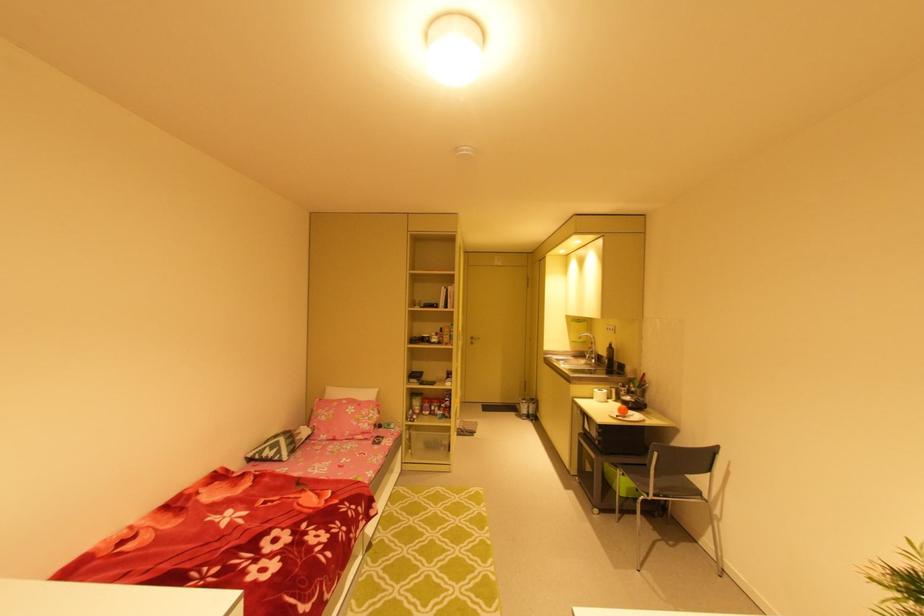
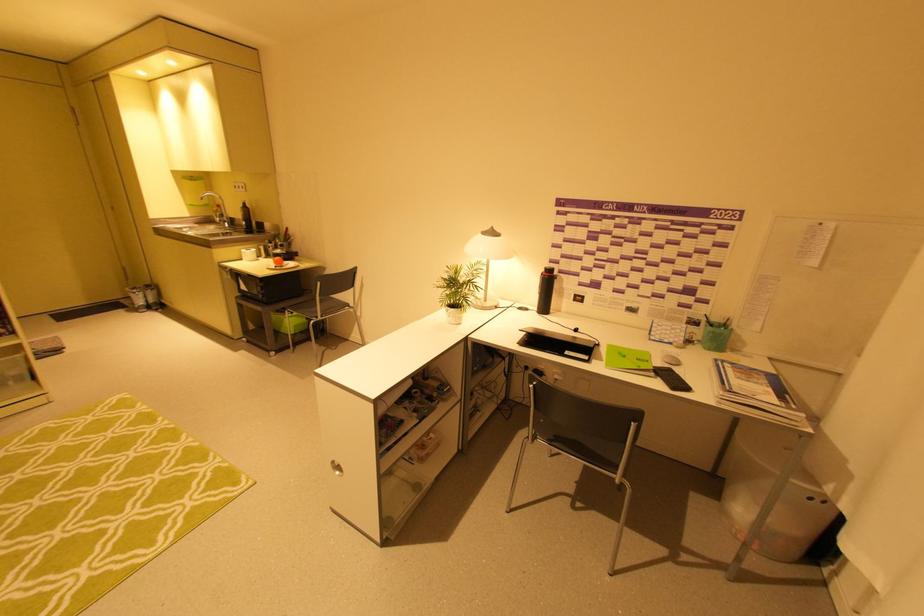
In the second image, find the point that corresponds to pixel 613 346 in the first image.

(246, 206)